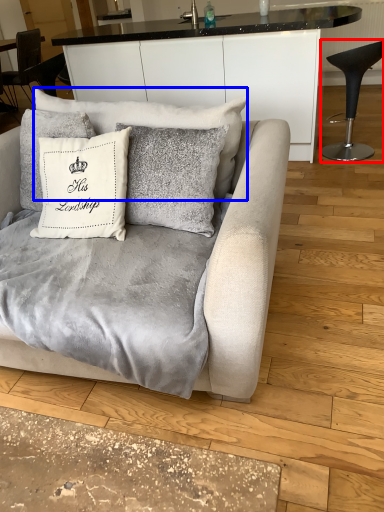
Question: Which object is closer to the camera taking this photo, chair (highlighted by a red box) or pillow (highlighted by a blue box)?

Choices:
 (A) chair
 (B) pillow

Answer: (B)